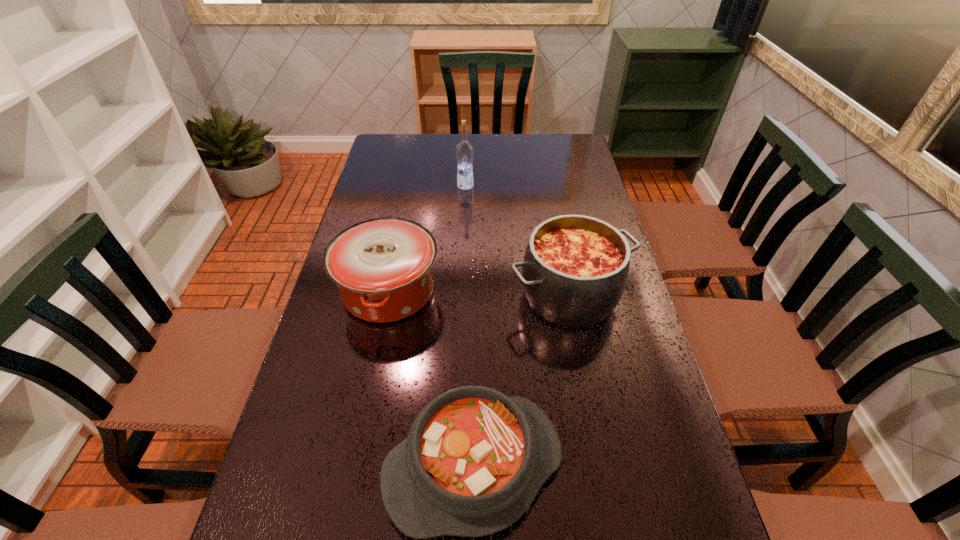
Where is `the tallest object`? the tallest object is located at coordinates (464, 150).

I want to click on vodka, so click(x=464, y=150).

Image resolution: width=960 pixels, height=540 pixels. I want to click on free point located on the back of the farthest object, so point(467,160).

Locate an element on the screen. This screenshot has height=540, width=960. object present at the left edge is located at coordinates (383, 268).

Find the location of a particular element. Image resolution: width=960 pixels, height=540 pixels. object at the right edge is located at coordinates (575, 270).

In the image, there is a desktop. Where is `vacant space at the far edge`? vacant space at the far edge is located at coordinates (445, 136).

Where is `vacant space at the left edge`? vacant space at the left edge is located at coordinates (294, 396).

Where is `blank area at the right edge`? The width and height of the screenshot is (960, 540). blank area at the right edge is located at coordinates (573, 211).

The image size is (960, 540). I want to click on free space at the far right corner of the desktop, so click(x=553, y=141).

Identify which object is the third nearest to the nearest object. Please provide its 2D coordinates. Your answer should be formatted as a tuple, i.e. [(x, y)], where the tuple contains the x and y coordinates of a point satisfying the conditions above.

[(464, 150)]